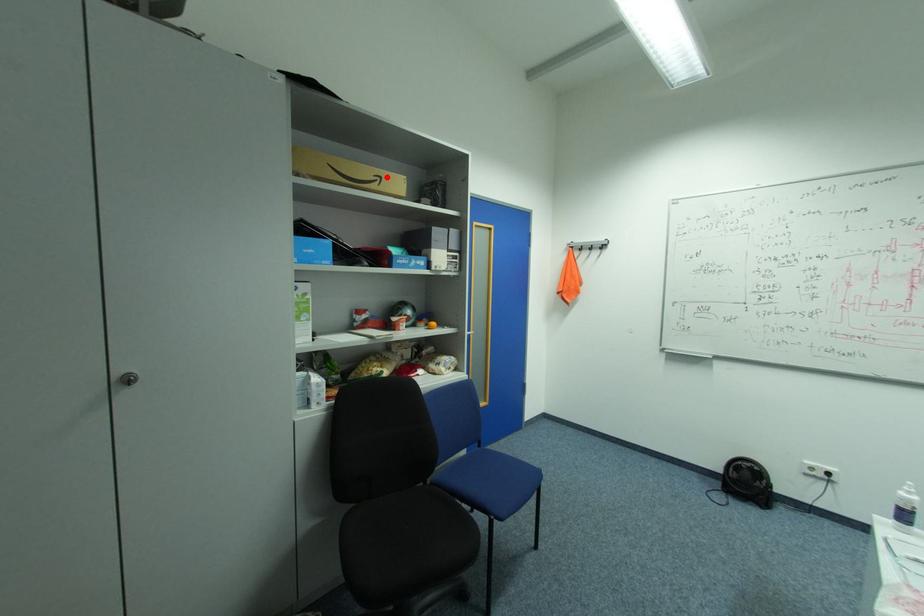
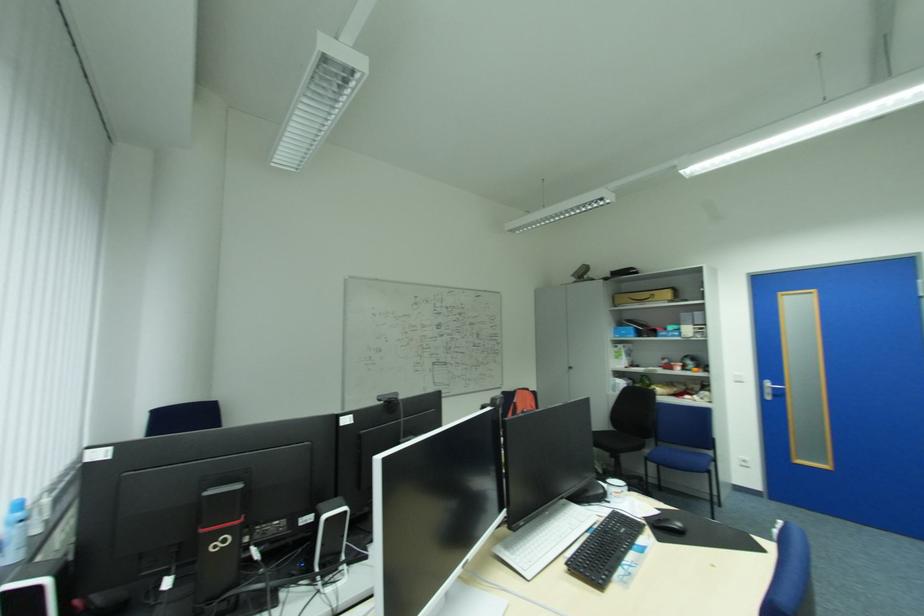
In the second image, find the point that corresponds to the highlighted location in the first image.

(659, 294)